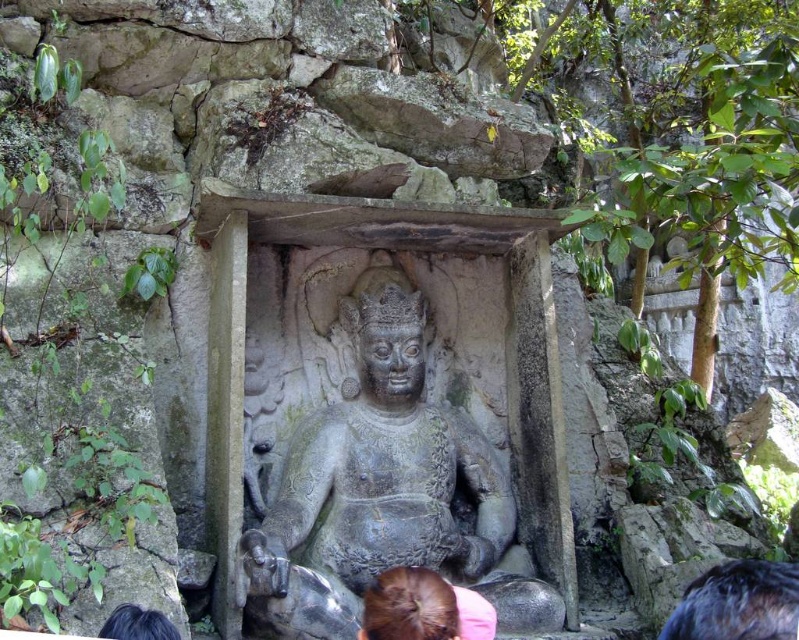
You are an archaeologist examining the ancient stone carving. You notice two strands of hair on the figure. The first is brown hair at lower center, and the second is black hair at lower left. Which strand of hair is bigger in size?

The brown hair at lower center has a larger size compared to the black hair at lower left, so the brown hair at lower center is bigger in size.

You are a tour guide leading a group to a historical site. You need to ensure that visitors can safely walk between the brown hair at lower center and the black hair at lower left. The path is narrow and has uneven terrain. What is the minimum width required for a wheelchair to pass through this path?

The distance between the brown hair at lower center and the black hair at lower left is 19.50 feet. However, the question asks for the minimum width required for a wheelchair to pass through the path. Since the path is narrow and has uneven terrain, the wheelchair requires a minimum width of at least 36 inches as per accessibility standards. The existing path width of 19.50 feet is more than sufficient, so the wheelchair can pass safely.

You are an archaeologist examining the ancient stone carving. You notice two points marked on the carving. Based on their positions, which point is closer to you, point (320, 429) or point (777, 605)?

Point (320, 429) is further to the viewer than point (777, 605), so point (320, 429) is closer to you.